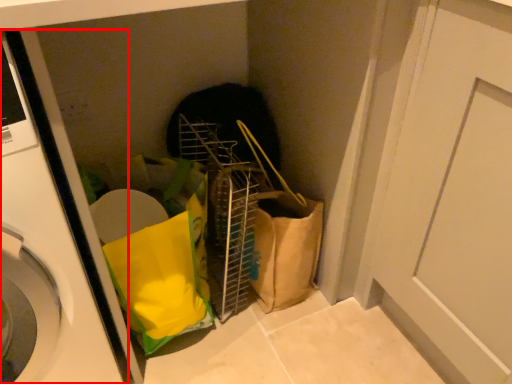
Question: From the image, what is the correct spatial relationship of washing machine (annotated by the red box) in relation to door?

Choices:
 (A) right
 (B) left

Answer: (B)